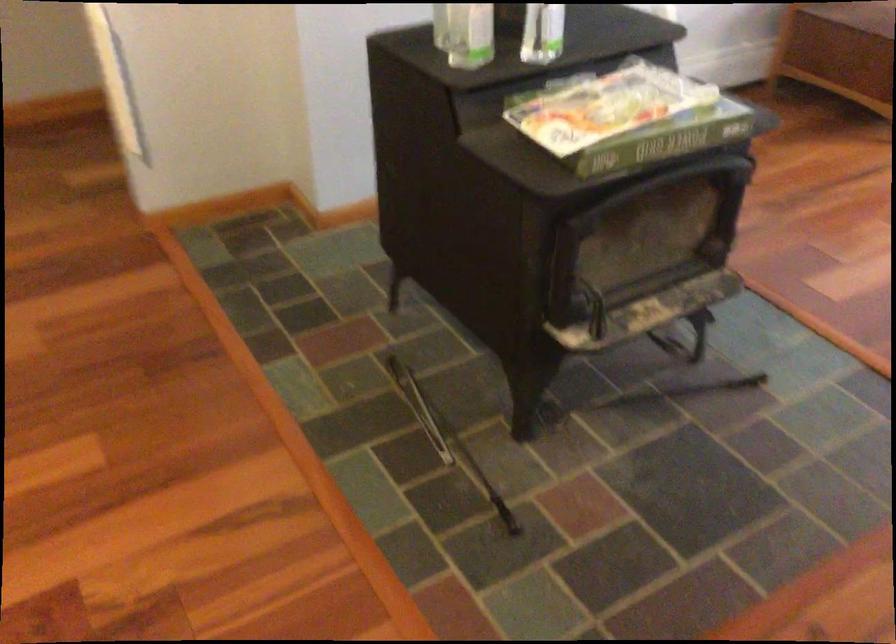
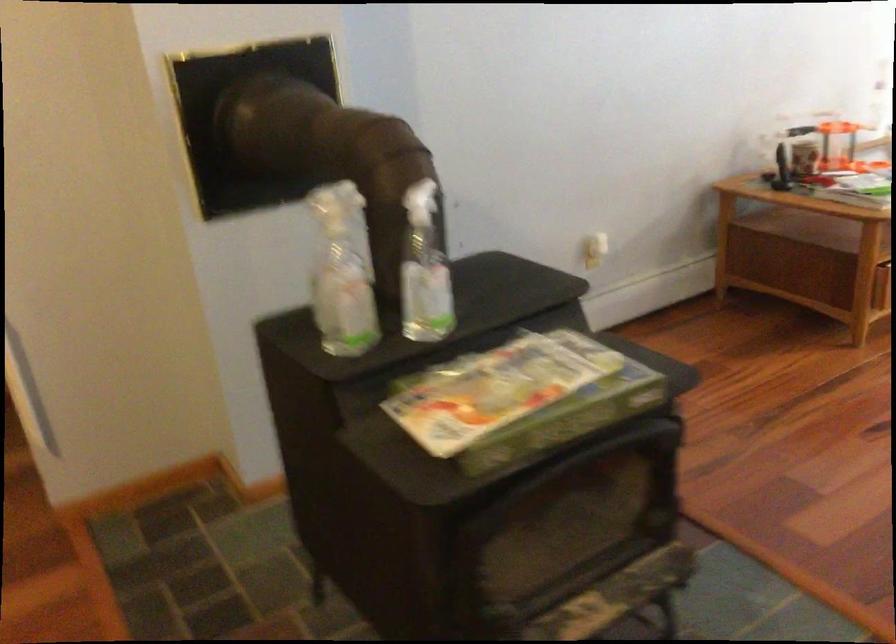
The images are taken continuously from a first-person perspective. In which direction are you moving?

The movement direction of the cameraman is right, forward.